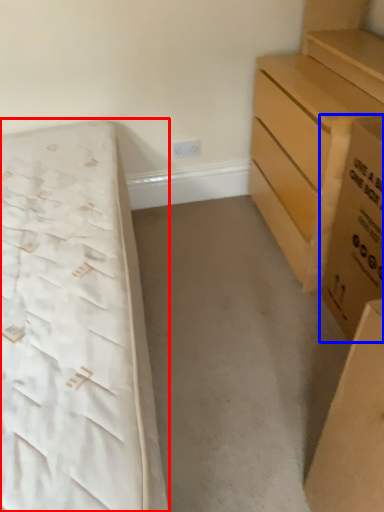
Question: Among these objects, which one is nearest to the camera, bed (highlighted by a red box) or cardboard box (highlighted by a blue box)?

Choices:
 (A) bed
 (B) cardboard box

Answer: (A)